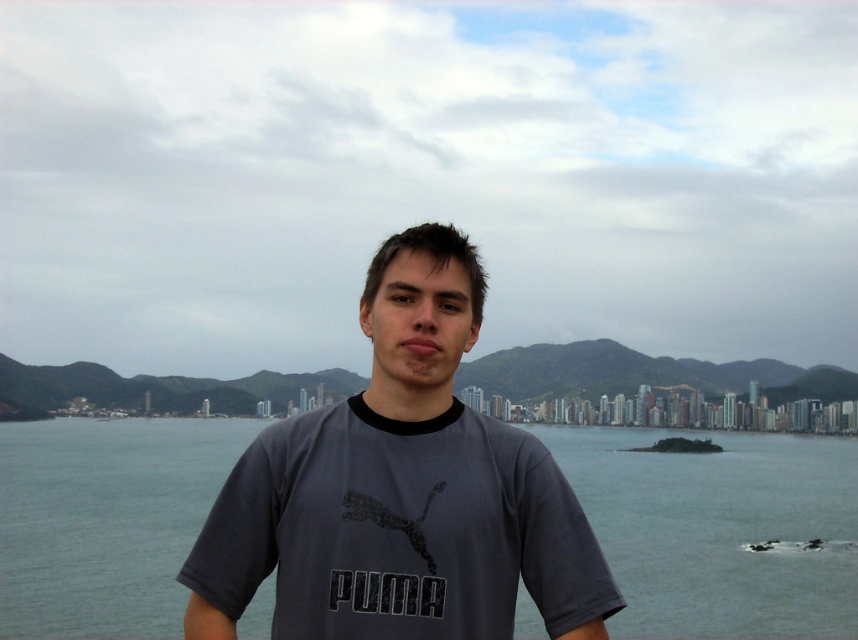
Question: Is gray water at center positioned in front of gray cotton t-shirt at center?

Choices:
 (A) no
 (B) yes

Answer: (A)

Question: Does gray water at center appear under gray cotton t-shirt at center?

Choices:
 (A) no
 (B) yes

Answer: (B)

Question: Which object is closer to the camera taking this photo?

Choices:
 (A) gray water at center
 (B) gray cotton t-shirt at center

Answer: (B)

Question: Is gray water at center in front of gray cotton t-shirt at center?

Choices:
 (A) no
 (B) yes

Answer: (A)

Question: Which point is farther to the camera?

Choices:
 (A) (167, 568)
 (B) (257, 458)

Answer: (A)

Question: Which point is closer to the camera?

Choices:
 (A) gray water at center
 (B) gray cotton t-shirt at center

Answer: (B)